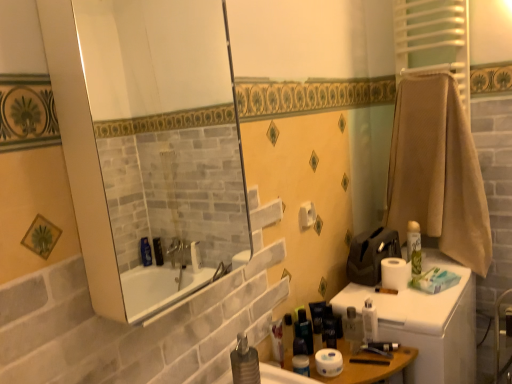
Question: Considering the relative positions of white glossy lotion at lower right, which appears as the 6th toiletry when viewed from the left, and white matte toilet paper at right, acting as the second toilet paper starting from the bottom, in the image provided, is white glossy lotion at lower right, which appears as the 6th toiletry when viewed from the left, to the left of white matte toilet paper at right, acting as the second toilet paper starting from the bottom, from the viewer's perspective?

Choices:
 (A) yes
 (B) no

Answer: (A)

Question: Does white glossy lotion at lower right, placed as the 2th toiletry when sorted from right to left, have a smaller size compared to white matte toilet paper at right, which is the third toilet paper from left to right?

Choices:
 (A) yes
 (B) no

Answer: (A)

Question: Does white glossy lotion at lower right, placed as the 2th toiletry when sorted from right to left, have a greater height compared to white matte toilet paper at right, which is the first toilet paper in right-to-left order?

Choices:
 (A) yes
 (B) no

Answer: (A)

Question: Is white matte toilet paper at right, which is the third toilet paper from left to right, located within white glossy lotion at lower right, which appears as the 6th toiletry when viewed from the left?

Choices:
 (A) no
 (B) yes

Answer: (A)

Question: Is white glossy lotion at lower right, which appears as the 6th toiletry when viewed from the left, oriented away from white matte toilet paper at right, which is the third toilet paper from left to right?

Choices:
 (A) no
 (B) yes

Answer: (B)

Question: From the image's perspective, is white glossy lotion at lower right, which appears as the 6th toiletry when viewed from the left, located above white matte toilet paper at right, the first toilet paper in the back-to-front sequence?

Choices:
 (A) no
 (B) yes

Answer: (A)

Question: From a real-world perspective, does white plastic toilet at right sit lower than white matte toilet paper at right, arranged as the second toilet paper when viewed from the top?

Choices:
 (A) yes
 (B) no

Answer: (A)

Question: Is white matte toilet paper at right, the third toilet paper viewed from the front, located within white plastic toilet at right?

Choices:
 (A) yes
 (B) no

Answer: (B)

Question: Is white plastic toilet at right smaller than white matte toilet paper at right, the first toilet paper in the back-to-front sequence?

Choices:
 (A) yes
 (B) no

Answer: (B)

Question: Is white plastic toilet at right shorter than white matte toilet paper at right, which is the first toilet paper in right-to-left order?

Choices:
 (A) no
 (B) yes

Answer: (A)

Question: Does white plastic toilet at right have a lesser width compared to white matte toilet paper at right, arranged as the second toilet paper when viewed from the top?

Choices:
 (A) no
 (B) yes

Answer: (A)

Question: Is white plastic toilet at right looking in the opposite direction of white matte toilet paper at right, which is the third toilet paper from left to right?

Choices:
 (A) yes
 (B) no

Answer: (B)

Question: Is matte black toiletry at lower center, which ranks as the fifth toiletry in right-to-left order, behind green matte spray can at right, which is the first toiletry from right to left?

Choices:
 (A) no
 (B) yes

Answer: (A)